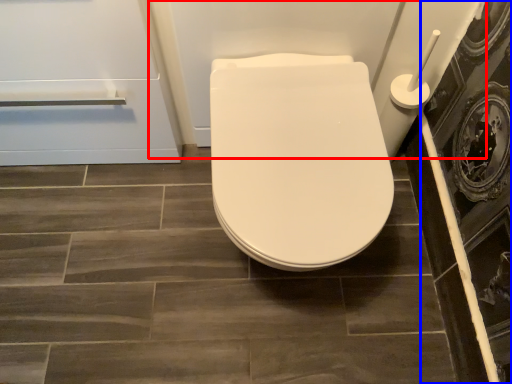
Question: Which point is closer to the camera, bath (highlighted by a red box) or screen door (highlighted by a blue box)?

Choices:
 (A) bath
 (B) screen door

Answer: (A)